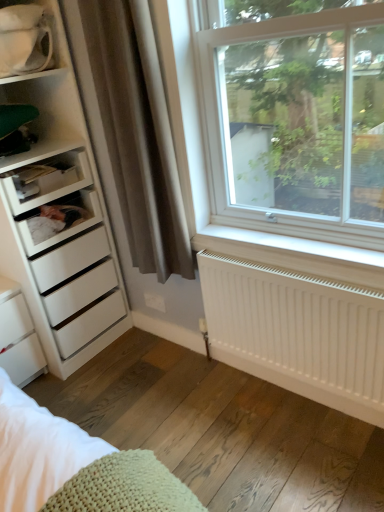
Question: Considering their positions, is white matte radiator at lower right located in front of or behind white glossy mug at upper left, which is the 1th shelf in top-to-bottom order?

Choices:
 (A) behind
 (B) front

Answer: (B)

Question: In terms of height, does white matte radiator at lower right look taller or shorter compared to white glossy mug at upper left, marked as the third shelf in a bottom-to-top arrangement?

Choices:
 (A) short
 (B) tall

Answer: (B)

Question: Which is farther from the white plastic shelf at left, the 2th shelf from the top?

Choices:
 (A) white matte radiator at lower right
 (B) white matte drawer at left, marked as the third shelf in a top-to-bottom arrangement
 (C) white plastic window at upper right
 (D) white matte chest of drawers at lower left
 (E) brown fabric curtain at left

Answer: (A)

Question: Which object is positioned farthest from the white matte drawer at left, marked as the third shelf in a top-to-bottom arrangement?

Choices:
 (A) brown fabric curtain at left
 (B) white matte radiator at lower right
 (C) white plastic shelf at left, the 2th shelf from the top
 (D) white plastic window at upper right
 (E) white matte chest of drawers at lower left

Answer: (D)